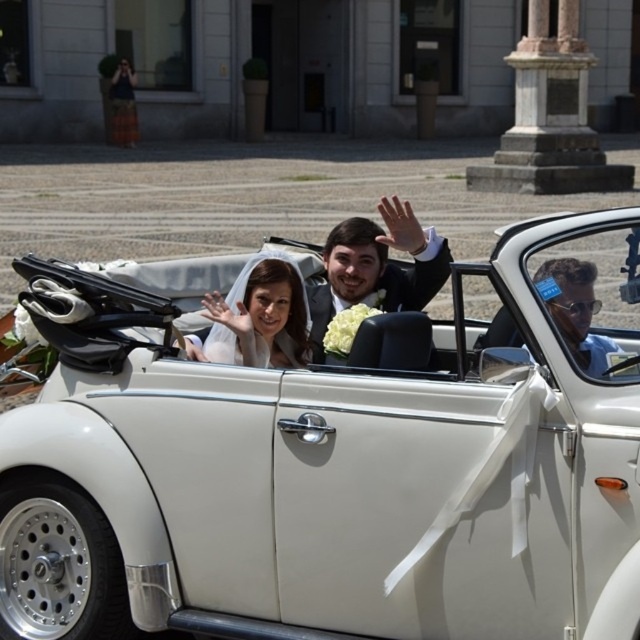
Is white matte convertible car at center closer to camera compared to white satin veil at center?

Yes, it is.

Does point (502, 435) come closer to viewer compared to point (278, 304)?

Yes, point (502, 435) is closer to viewer.

Between point (433, 438) and point (211, 348), which one is positioned in front?

Point (433, 438)

You are a GUI agent. You are given a task and a screenshot of the screen. Output one action in this format:
    pyautogui.click(x=<x>, y=<y>)
    Task: Click on the white matte convertible car at center
    This screenshot has height=640, width=640.
    Given the screenshot: What is the action you would take?
    pyautogui.click(x=337, y=461)

Is matte black suit at center wider than sunglassesmaterial/texture at position?

Yes.

Locate an element on the screen. The height and width of the screenshot is (640, 640). matte black suit at center is located at coordinates (376, 266).

Who is positioned more to the right, matte black suit at center or white satin veil at center?

From the viewer's perspective, matte black suit at center appears more on the right side.

Does matte black suit at center appear over white satin veil at center?

Indeed, matte black suit at center is positioned over white satin veil at center.

You are a GUI agent. You are given a task and a screenshot of the screen. Output one action in this format:
    pyautogui.click(x=<x>, y=<y>)
    Task: Click on the matte black suit at center
    This screenshot has width=640, height=640.
    Given the screenshot: What is the action you would take?
    pyautogui.click(x=376, y=266)

Find the location of a particular element. The height and width of the screenshot is (640, 640). matte black suit at center is located at coordinates (376, 266).